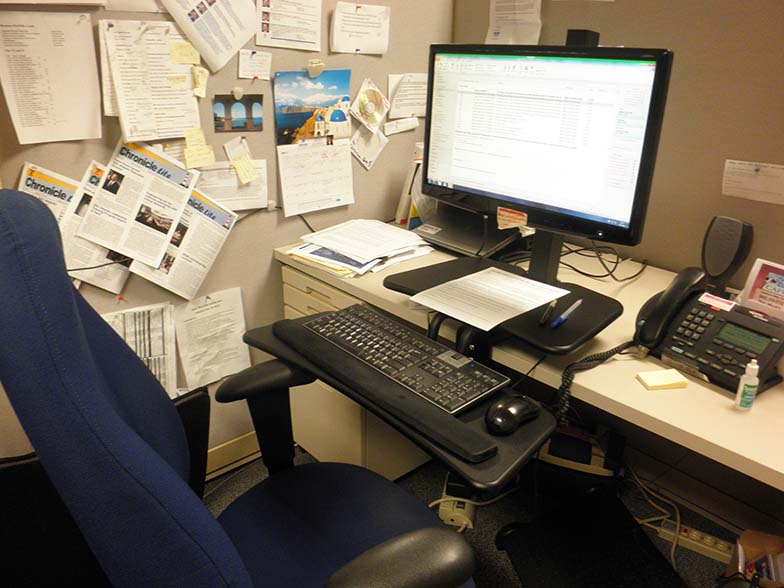
This screenshot has width=784, height=588. I want to click on keyboarr, so click(x=380, y=387).